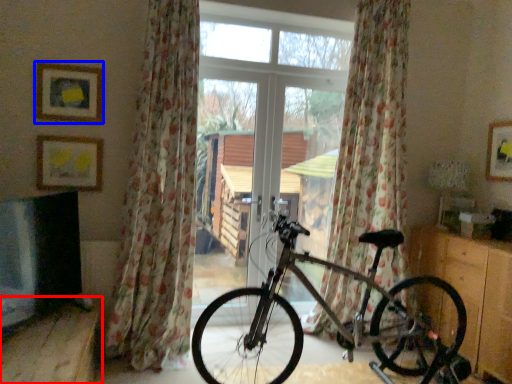
Question: Which object is closer to the camera taking this photo, furniture (highlighted by a red box) or picture frame (highlighted by a blue box)?

Choices:
 (A) furniture
 (B) picture frame

Answer: (A)